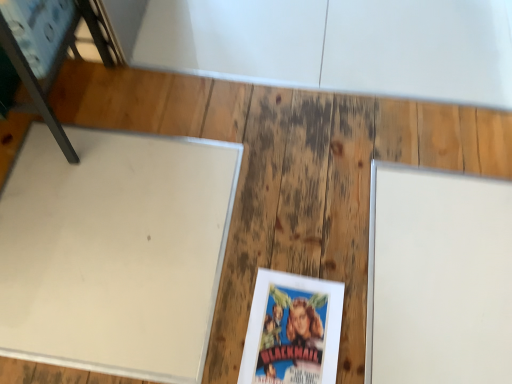
The height and width of the screenshot is (384, 512). I want to click on vacant area that lies between matte paper book at center and white matte board at left, so click(x=263, y=256).